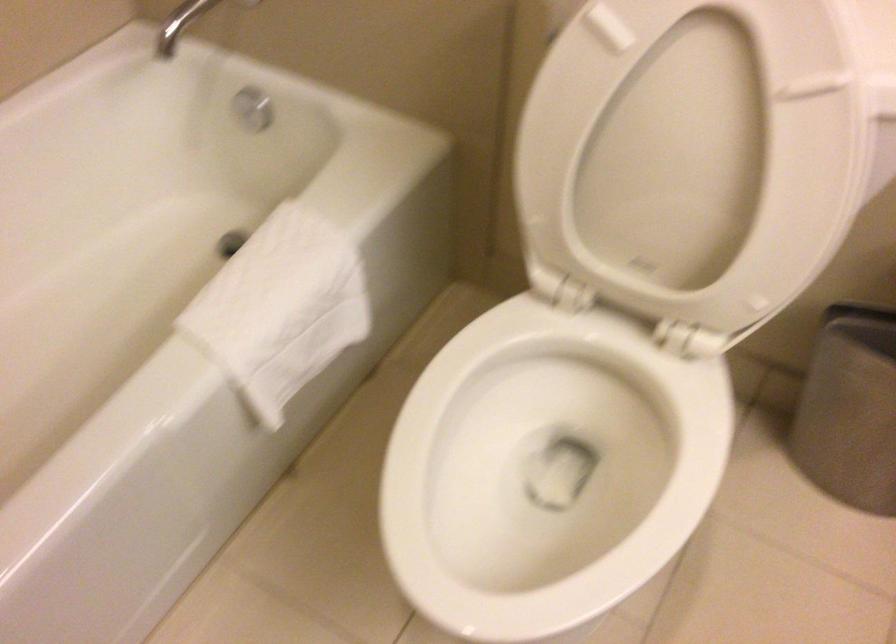
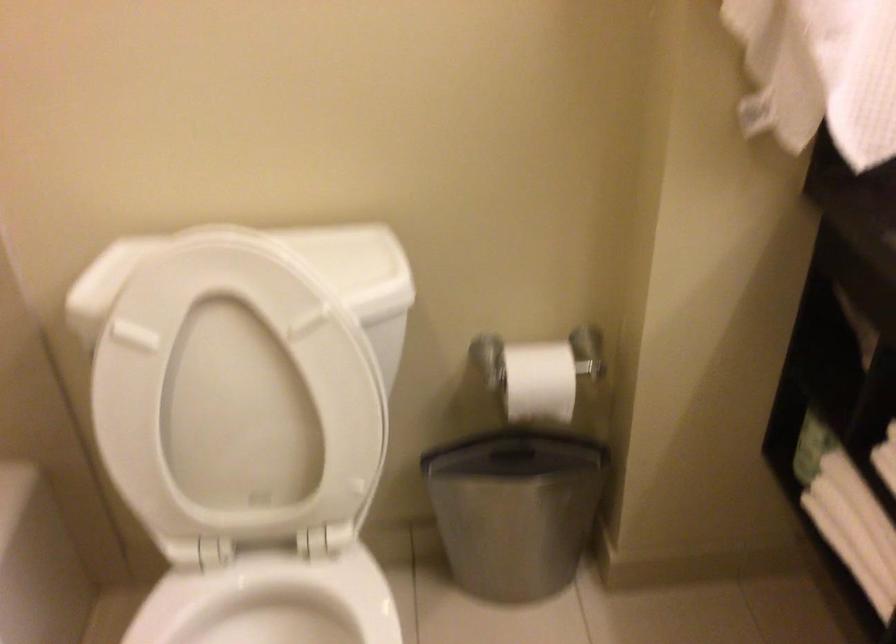
Question: The first image is from the beginning of the video and the second image is from the end. How did the camera likely rotate when shooting the video?

Choices:
 (A) Left
 (B) Right
 (C) Up
 (D) Down

Answer: (B)